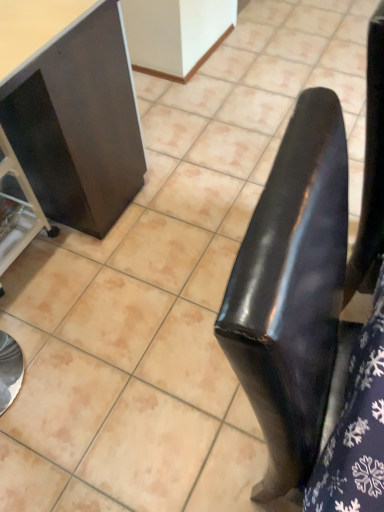
Question: Looking at the image, does matte black cabinet at left, placed as the first furniture when sorted from right to left, seem bigger or smaller compared to metallic silver cart at left, the 2th furniture when ordered from right to left?

Choices:
 (A) small
 (B) big

Answer: (B)

Question: Is point (119, 155) positioned closer to the camera than point (21, 183)?

Choices:
 (A) farther
 (B) closer

Answer: (A)

Question: Is matte black cabinet at left, placed as the first furniture when sorted from right to left, inside the boundaries of metallic silver cart at left, the 1th furniture positioned from the left, or outside?

Choices:
 (A) outside
 (B) inside

Answer: (A)

Question: Considering the positions of point (38, 208) and point (107, 2), is point (38, 208) closer or farther from the camera than point (107, 2)?

Choices:
 (A) closer
 (B) farther

Answer: (B)

Question: Looking at their shapes, would you say metallic silver cart at left, the 2th furniture when ordered from right to left, is wider or thinner than matte black cabinet at left, placed as the first furniture when sorted from right to left?

Choices:
 (A) wide
 (B) thin

Answer: (B)

Question: Considering the positions of metallic silver cart at left, the 1th furniture positioned from the left, and matte black cabinet at left, placed as the first furniture when sorted from right to left, in the image, is metallic silver cart at left, the 1th furniture positioned from the left, taller or shorter than matte black cabinet at left, placed as the first furniture when sorted from right to left,?

Choices:
 (A) tall
 (B) short

Answer: (B)

Question: Based on their sizes in the image, would you say metallic silver cart at left, the 2th furniture when ordered from right to left, is bigger or smaller than matte black cabinet at left, placed as the 2th furniture when sorted from left to right?

Choices:
 (A) big
 (B) small

Answer: (B)